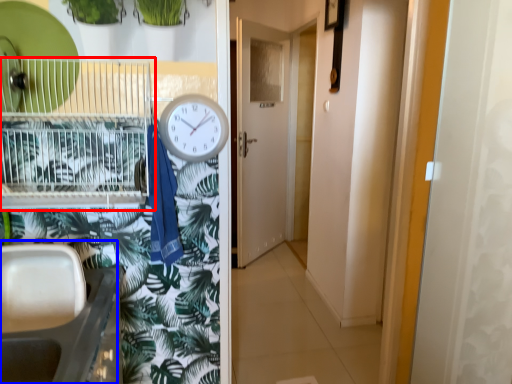
Question: Among these objects, which one is farthest to the camera, bird cage (highlighted by a red box) or sink (highlighted by a blue box)?

Choices:
 (A) bird cage
 (B) sink

Answer: (A)